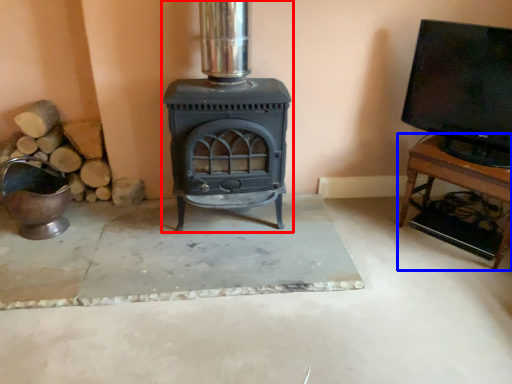
Question: Which object is closer to the camera taking this photo, wood burning stove (highlighted by a red box) or furniture (highlighted by a blue box)?

Choices:
 (A) wood burning stove
 (B) furniture

Answer: (A)